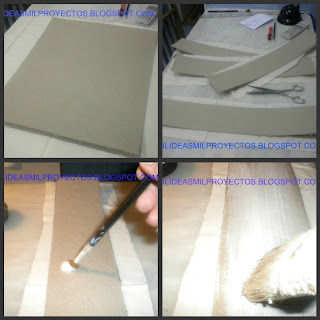
Locate an element on the screen. This screenshot has width=320, height=320. cardboard surface is located at coordinates (93, 281).